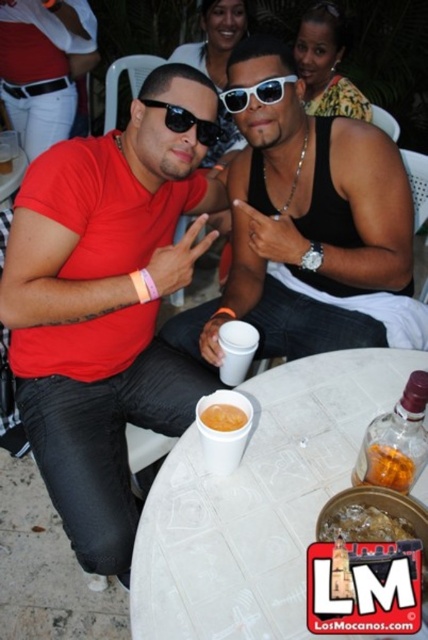
Question: Does black tank top at center appear over matte red shirt at center?

Choices:
 (A) yes
 (B) no

Answer: (B)

Question: Which is nearer to the translucent glass bowl at table center?

Choices:
 (A) matte red shirt at center
 (B) black plastic sunglasses at center
 (C) white plastic table at center
 (D) black tank top at center

Answer: (D)

Question: Is matte red shirt at center below white plastic table at center?

Choices:
 (A) yes
 (B) no

Answer: (B)

Question: Which object is positioned farthest from the white tile table at center?

Choices:
 (A) matte red shirt at center
 (B) black plastic sunglasses at center

Answer: (A)

Question: Which object is closer to the camera taking this photo?

Choices:
 (A) white plastic table at center
 (B) yellow matte cupcake at center

Answer: (B)

Question: Can you confirm if translucent glass bowl at table center is positioned above yellow matte cupcake at center?

Choices:
 (A) yes
 (B) no

Answer: (B)